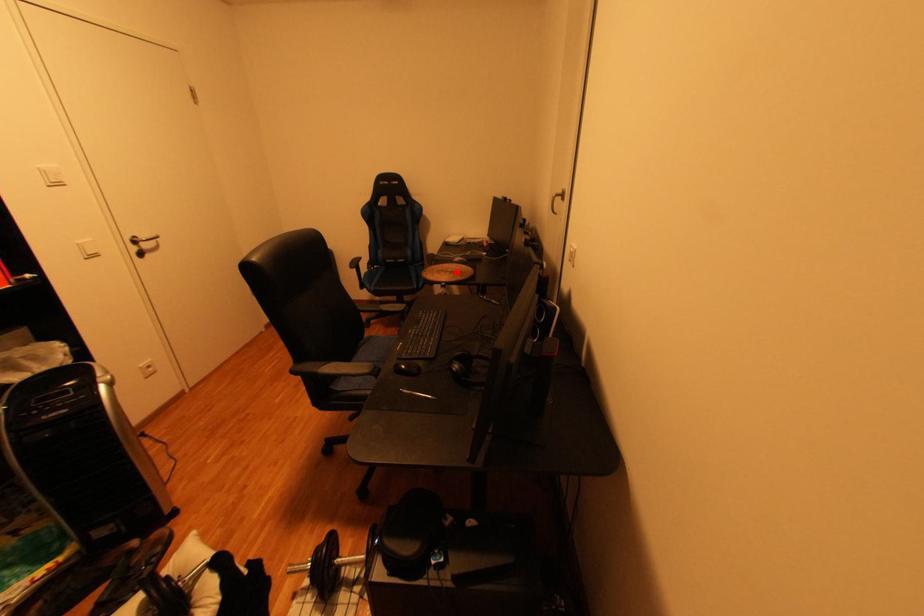
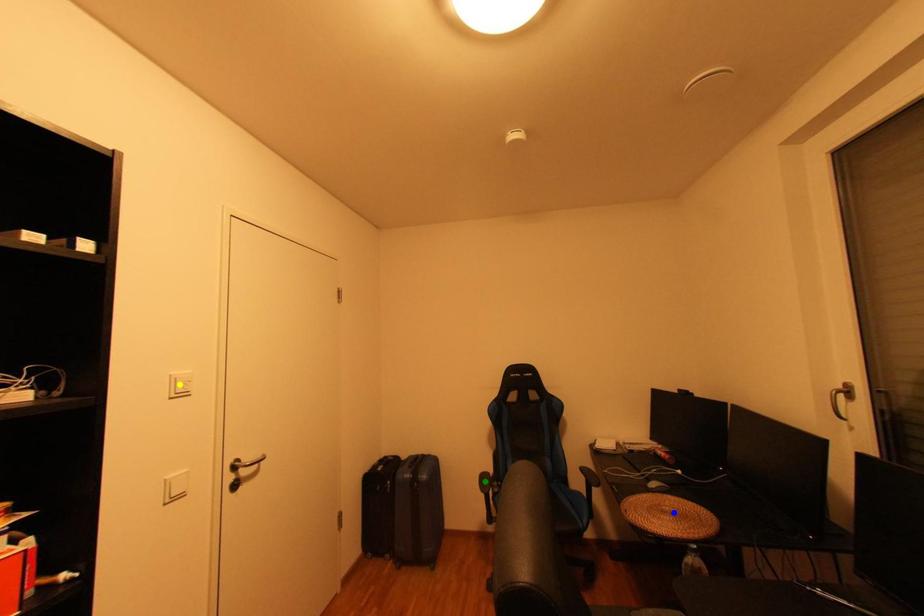
Question: I am providing you with two images of the same scene from different viewpoints. A red point is marked on the first image. You are given multiple points on the second image. Which point in image 2 is actually the same real-world point as the red point in image 1?

Choices:
 (A) blue point
 (B) green point
 (C) yellow point

Answer: (A)